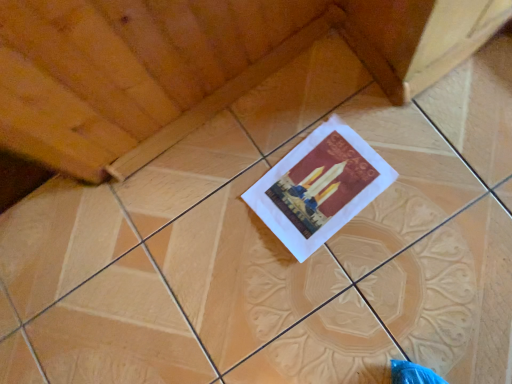
Identify the location of vacant point to the left of matte paper postcard at center. (240, 256).